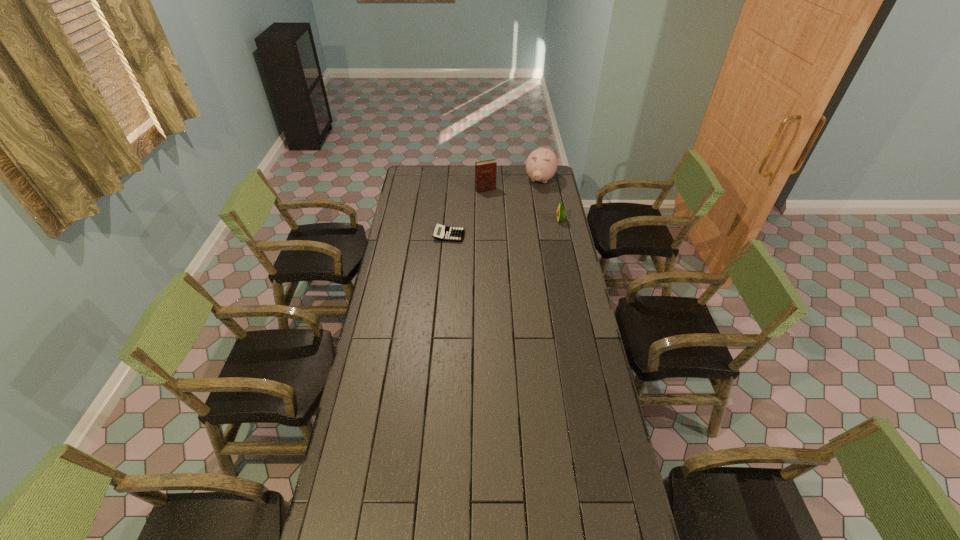
At what (x,y) coordinates should I click in order to perform the action: click on vacant space on the desktop that is between the nearest object and the third tallest object and is positioned on the front cover of the second object from left to right. Please return your answer as a coordinate pair (x, y). Looking at the image, I should click on (509, 227).

Find the location of a particular element. vacant space on the desktop that is between the calculator and the third farthest object and is positioned at the snout of the piggy bank is located at coordinates 520,226.